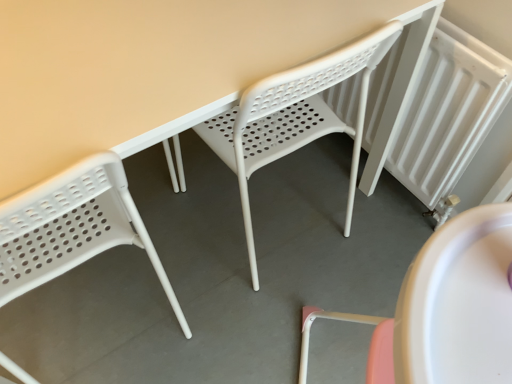
Where is `vacant area that lies in front of white textured radiator at right`? vacant area that lies in front of white textured radiator at right is located at coordinates (366, 241).